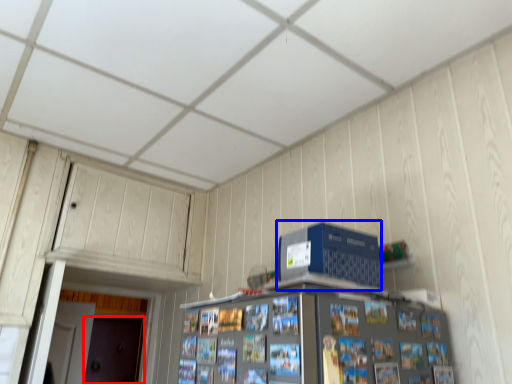
Question: Among these objects, which one is farthest to the camera, door (highlighted by a red box) or computer (highlighted by a blue box)?

Choices:
 (A) door
 (B) computer

Answer: (A)